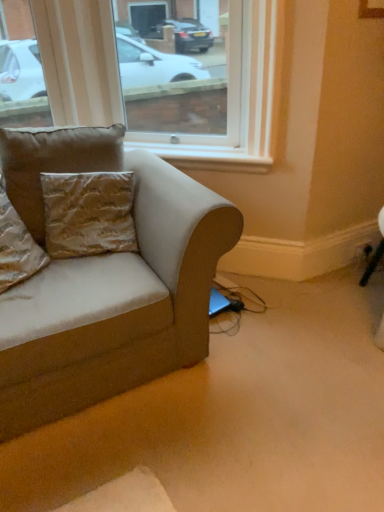
Question: Choose the correct answer: Is transparent glass window at upper center inside suede-like beige couch at left or outside it?

Choices:
 (A) inside
 (B) outside

Answer: (B)

Question: Considering the relative positions of transparent glass window at upper center and suede-like beige couch at left in the image provided, is transparent glass window at upper center to the left or to the right of suede-like beige couch at left?

Choices:
 (A) right
 (B) left

Answer: (A)

Question: Which object is the closest to the transparent glass window at upper center?

Choices:
 (A) white painted wood at upper center
 (B) gold textured pillow at upper left, which is counted as the second pillow, starting from the left
 (C) gold textured pillow at left, the 1th pillow viewed from the left
 (D) suede-like beige couch at left
 (E) black plastic outlet at lower right

Answer: (A)

Question: Which object is the farthest from the suede-like beige couch at left?

Choices:
 (A) gold textured pillow at upper left, which ranks as the first pillow in right-to-left order
 (B) gold textured pillow at left, positioned as the second pillow in right-to-left order
 (C) black plastic outlet at lower right
 (D) transparent glass window at upper center
 (E) white painted wood at upper center

Answer: (C)